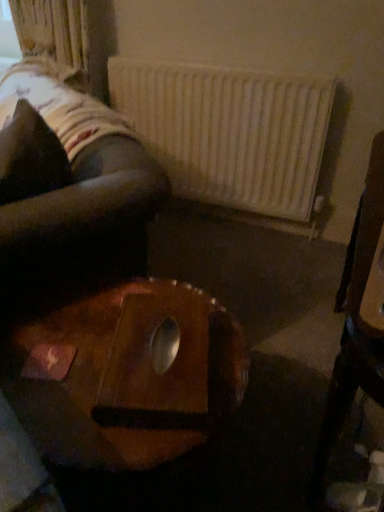
Question: Would you say velvety black pillow at upper left is part of wooden chair at right's contents?

Choices:
 (A) yes
 (B) no

Answer: (B)

Question: Is there a large distance between wooden chair at right and velvety black pillow at upper left?

Choices:
 (A) no
 (B) yes

Answer: (A)

Question: Does wooden chair at right have a larger size compared to velvety black pillow at upper left?

Choices:
 (A) no
 (B) yes

Answer: (B)

Question: From the image's perspective, is wooden chair at right on velvety black pillow at upper left?

Choices:
 (A) no
 (B) yes

Answer: (A)

Question: Does wooden chair at right turn towards velvety black pillow at upper left?

Choices:
 (A) yes
 (B) no

Answer: (A)

Question: Can you confirm if wooden chair at right is smaller than velvety black pillow at upper left?

Choices:
 (A) yes
 (B) no

Answer: (B)

Question: Is white matte radiator at upper center positioned beyond the bounds of wooden table at center?

Choices:
 (A) yes
 (B) no

Answer: (A)

Question: Can you confirm if white matte radiator at upper center is shorter than wooden table at center?

Choices:
 (A) yes
 (B) no

Answer: (B)

Question: Considering the relative sizes of white matte radiator at upper center and wooden table at center in the image provided, is white matte radiator at upper center smaller than wooden table at center?

Choices:
 (A) yes
 (B) no

Answer: (A)

Question: From a real-world perspective, is white matte radiator at upper center on wooden table at center?

Choices:
 (A) no
 (B) yes

Answer: (B)

Question: Is wooden table at center surrounded by white matte radiator at upper center?

Choices:
 (A) no
 (B) yes

Answer: (A)

Question: Is the position of white matte radiator at upper center more distant than that of wooden table at center?

Choices:
 (A) no
 (B) yes

Answer: (B)

Question: Does velvety black pillow at upper left lie behind white matte radiator at upper center?

Choices:
 (A) no
 (B) yes

Answer: (A)